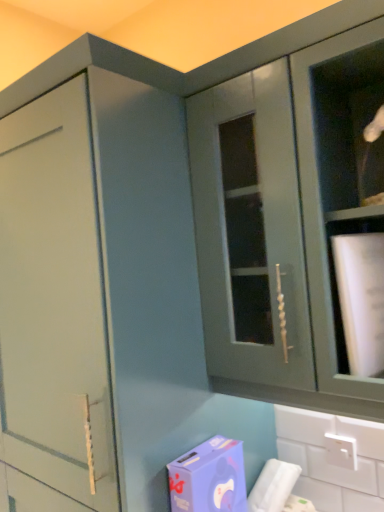
Image resolution: width=384 pixels, height=512 pixels. What do you see at coordinates (209, 478) in the screenshot?
I see `purple matte cardboard box at lower center` at bounding box center [209, 478].

Measure the distance between point [227,510] and camera.

Point [227,510] and camera are 3.33 feet apart.

What are the coordinates of `purple matte cardboard box at lower center` in the screenshot? It's located at (209, 478).

Identify the location of matte green cabinet at upper right. The height and width of the screenshot is (512, 384). (290, 202).

This screenshot has height=512, width=384. What do you see at coordinates (290, 202) in the screenshot? I see `matte green cabinet at upper right` at bounding box center [290, 202].

You are a GUI agent. You are given a task and a screenshot of the screen. Output one action in this format:
    pyautogui.click(x=<x>, y=<y>)
    Task: Click on the purple matte cardboard box at lower center
    This screenshot has width=384, height=512.
    Given the screenshot: What is the action you would take?
    pyautogui.click(x=209, y=478)

Is purple matte cardboard box at lower center to the right of matte green cabinet at upper right from the viewer's perspective?

In fact, purple matte cardboard box at lower center is to the left of matte green cabinet at upper right.

Considering their positions, is purple matte cardboard box at lower center located in front of or behind matte green cabinet at upper right?

Visually, purple matte cardboard box at lower center is located behind matte green cabinet at upper right.

Is point (218, 472) positioned before point (204, 218)?

That is True.

From the image's perspective, is purple matte cardboard box at lower center located above matte green cabinet at upper right?

No.

From a real-world perspective, is purple matte cardboard box at lower center positioned above or below matte green cabinet at upper right?

In terms of real-world spatial position, purple matte cardboard box at lower center is below matte green cabinet at upper right.

Which object is thinner, purple matte cardboard box at lower center or matte green cabinet at upper right?

purple matte cardboard box at lower center.

From their relative heights in the image, would you say purple matte cardboard box at lower center is taller or shorter than matte green cabinet at upper right?

Considering their sizes, purple matte cardboard box at lower center has less height than matte green cabinet at upper right.

Considering the sizes of purple matte cardboard box at lower center and matte green cabinet at upper right in the image, is purple matte cardboard box at lower center bigger or smaller than matte green cabinet at upper right?

Clearly, purple matte cardboard box at lower center is smaller in size than matte green cabinet at upper right.

Is matte green cabinet at upper right inside purple matte cardboard box at lower center?

No, matte green cabinet at upper right is located outside of purple matte cardboard box at lower center.

Does purple matte cardboard box at lower center touch matte green cabinet at upper right?

No.

Based on the photo, could you tell me if purple matte cardboard box at lower center is turned towards matte green cabinet at upper right?

No, purple matte cardboard box at lower center is not aimed at matte green cabinet at upper right.

Can you tell me how much purple matte cardboard box at lower center and matte green cabinet at upper right differ in facing direction?

There is a 4.86-degree angle between the facing directions of purple matte cardboard box at lower center and matte green cabinet at upper right.

Based on the photo, measure the distance from purple matte cardboard box at lower center to matte green cabinet at upper right.

purple matte cardboard box at lower center is 20.38 inches from matte green cabinet at upper right.

Where is `cabinetry located in front of the purple matte cardboard box at lower center`? cabinetry located in front of the purple matte cardboard box at lower center is located at coordinates (290, 202).

In the scene shown: Which is more to the left, matte green cabinet at upper right or purple matte cardboard box at lower center?

purple matte cardboard box at lower center is more to the left.

Which object is closer to the camera, matte green cabinet at upper right or purple matte cardboard box at lower center?

Positioned in front is matte green cabinet at upper right.

Is point (366, 109) closer or farther from the camera than point (217, 511)?

Point (366, 109) is farther from the camera than point (217, 511).

From the image's perspective, which object appears higher, matte green cabinet at upper right or purple matte cardboard box at lower center?

From the image's view, matte green cabinet at upper right is above.

From a real-world perspective, which is physically below, matte green cabinet at upper right or purple matte cardboard box at lower center?

purple matte cardboard box at lower center.

Considering the sizes of objects matte green cabinet at upper right and purple matte cardboard box at lower center in the image provided, who is wider, matte green cabinet at upper right or purple matte cardboard box at lower center?

matte green cabinet at upper right is wider.

Considering the sizes of objects matte green cabinet at upper right and purple matte cardboard box at lower center in the image provided, who is shorter, matte green cabinet at upper right or purple matte cardboard box at lower center?

purple matte cardboard box at lower center is shorter.

Is matte green cabinet at upper right smaller than purple matte cardboard box at lower center?

Incorrect, matte green cabinet at upper right is not smaller in size than purple matte cardboard box at lower center.

Is matte green cabinet at upper right surrounding purple matte cardboard box at lower center?

No, purple matte cardboard box at lower center is located outside of matte green cabinet at upper right.

Are matte green cabinet at upper right and purple matte cardboard box at lower center located far from each other?

Actually, matte green cabinet at upper right and purple matte cardboard box at lower center are a little close together.

Could you tell me if matte green cabinet at upper right is facing purple matte cardboard box at lower center?

No, matte green cabinet at upper right is not turned towards purple matte cardboard box at lower center.

I want to click on cabinetry positioned vertically above the purple matte cardboard box at lower center (from a real-world perspective), so click(x=290, y=202).

Find the location of a particular element. cardboard box behind the matte green cabinet at upper right is located at coordinates (209, 478).

Identify the location of cabinetry located above the purple matte cardboard box at lower center (from the image's perspective). (290, 202).